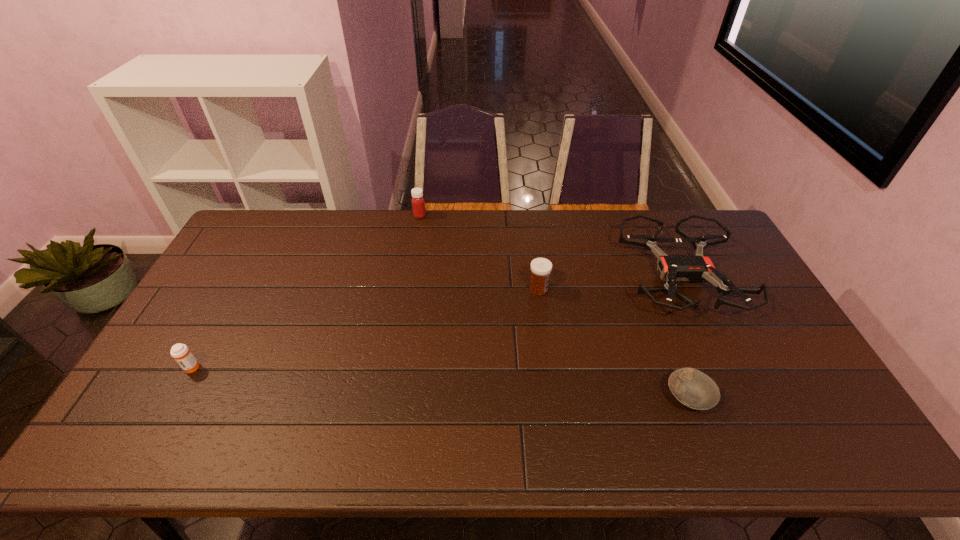
Locate an element on the screen. free space at the near edge of the desktop is located at coordinates pyautogui.click(x=292, y=448).

Where is `vacant space at the left edge of the desktop`? vacant space at the left edge of the desktop is located at coordinates (211, 280).

Where is `free space at the right edge of the desktop`? This screenshot has width=960, height=540. free space at the right edge of the desktop is located at coordinates (734, 329).

The height and width of the screenshot is (540, 960). I want to click on free space at the far left corner of the desktop, so click(276, 238).

Locate an element on the screen. vacant space in between the second object from left to right and the second nearest medicine is located at coordinates (479, 252).

The height and width of the screenshot is (540, 960). I want to click on free spot between the rightmost medicine and the fourth object from right to left, so click(479, 252).

You are a GUI agent. You are given a task and a screenshot of the screen. Output one action in this format:
    pyautogui.click(x=<x>, y=<y>)
    Task: Click on the vacant space that's between the fourth object from right to left and the bowl
    Image resolution: width=960 pixels, height=540 pixels.
    Given the screenshot: What is the action you would take?
    pyautogui.click(x=554, y=306)

I want to click on vacant space in between the third object from left to right and the leftmost medicine, so click(x=365, y=328).

At what (x,y) coordinates should I click in order to perform the action: click on empty location between the drone and the second nearest object. Please return your answer as a coordinate pair (x, y). Looking at the image, I should click on (436, 322).

At what (x,y) coordinates should I click in order to perform the action: click on empty space that is in between the drone and the fourth object from right to left. Please return your answer as a coordinate pair (x, y). Looking at the image, I should click on (550, 247).